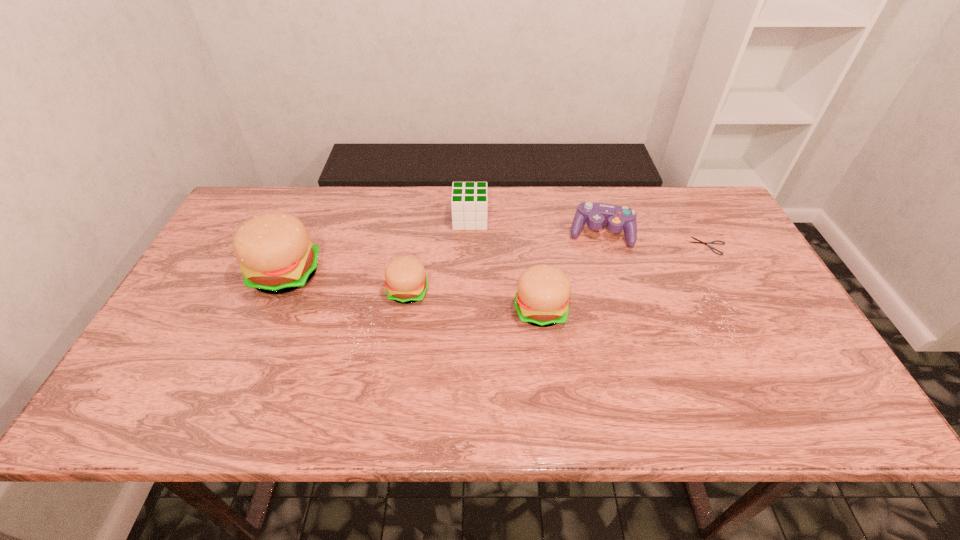
What are the coordinates of `vacant area in the image that satisfies the following two spatial constraints: 1. on the back side of the second shortest hamburger; 2. on the right side of the second object from right to left` in the screenshot? It's located at (531, 233).

Locate an element on the screen. free space that satisfies the following two spatial constraints: 1. on the front side of the second tallest hamburger; 2. on the right side of the second object from left to right is located at coordinates (405, 310).

Where is `vacant space that satisfies the following two spatial constraints: 1. on the back side of the shortest object; 2. on the right side of the leftmost hamburger`? The image size is (960, 540). vacant space that satisfies the following two spatial constraints: 1. on the back side of the shortest object; 2. on the right side of the leftmost hamburger is located at coordinates (298, 246).

Identify the location of free location that satisfies the following two spatial constraints: 1. on the red face of the fourth object from right to left; 2. on the left side of the shears. (469, 246).